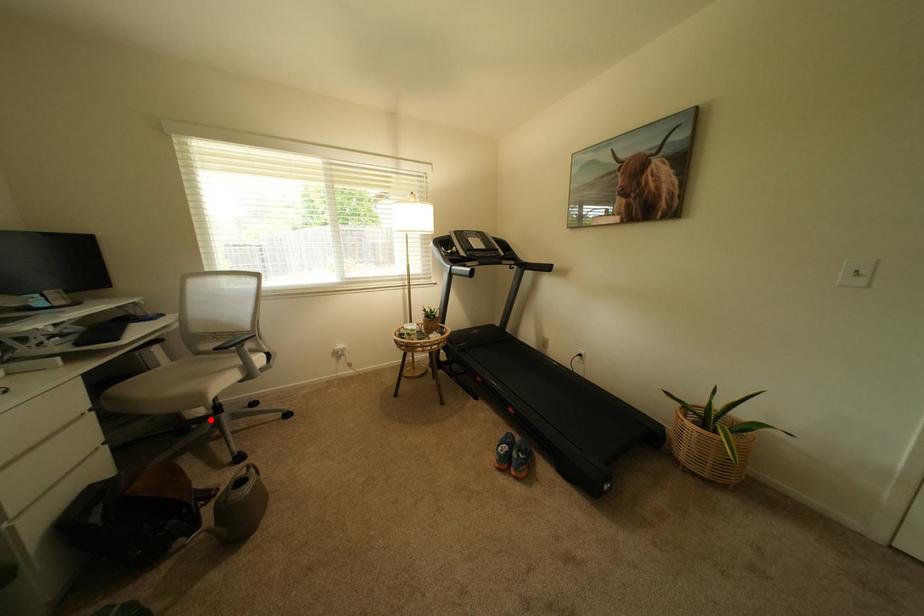
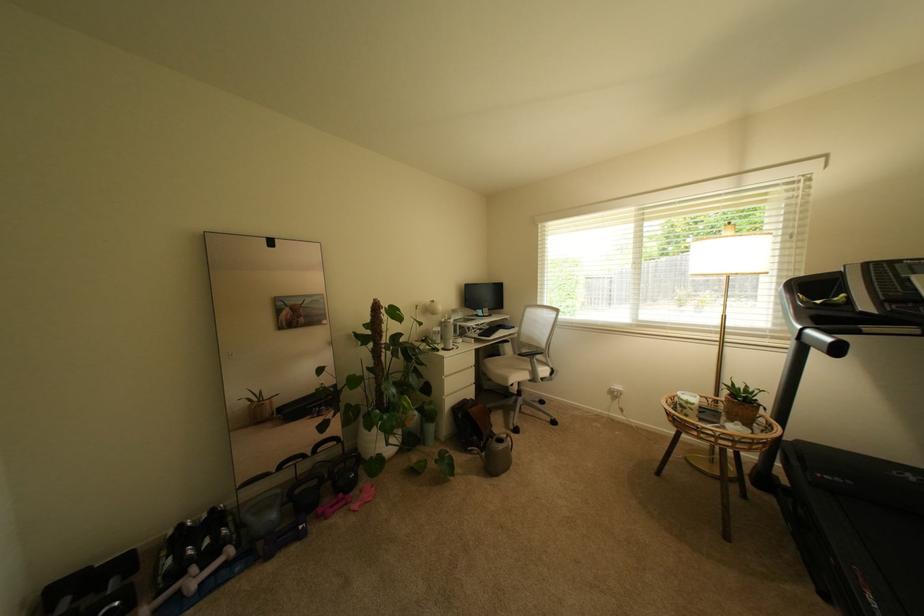
Find the pixel in the second image that matches the highlighted location in the first image.

(521, 395)